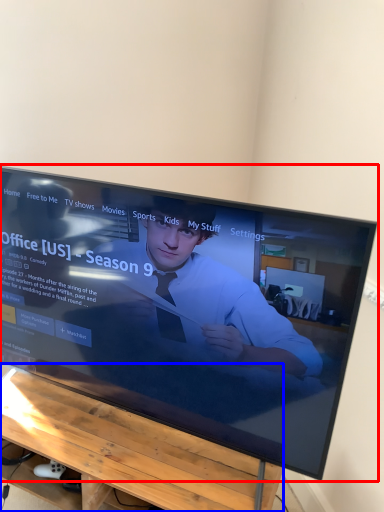
Question: Which point is closer to the camera, television (highlighted by a red box) or furniture (highlighted by a blue box)?

Choices:
 (A) television
 (B) furniture

Answer: (A)